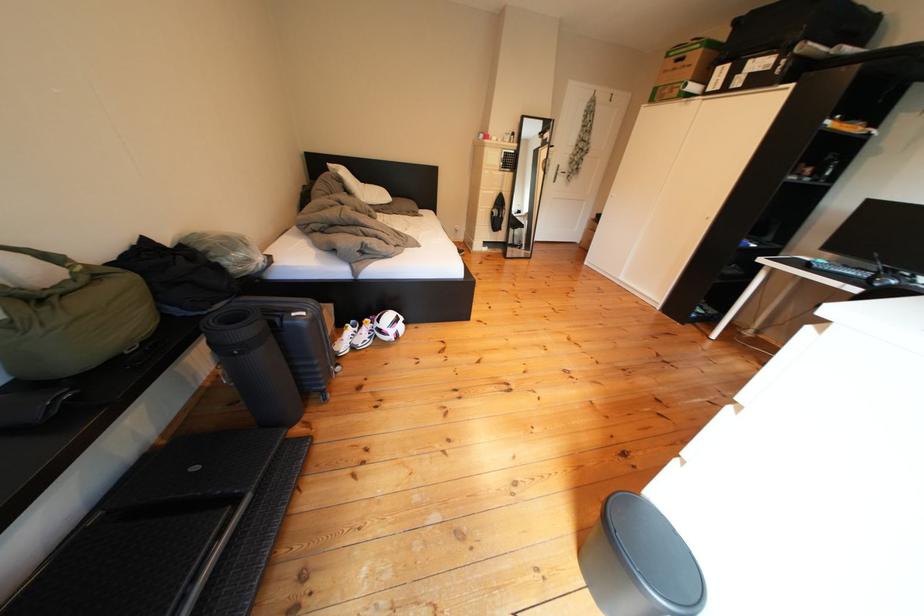
This screenshot has width=924, height=616. Describe the element at coordinates (563, 172) in the screenshot. I see `the wardrobe door handle` at that location.